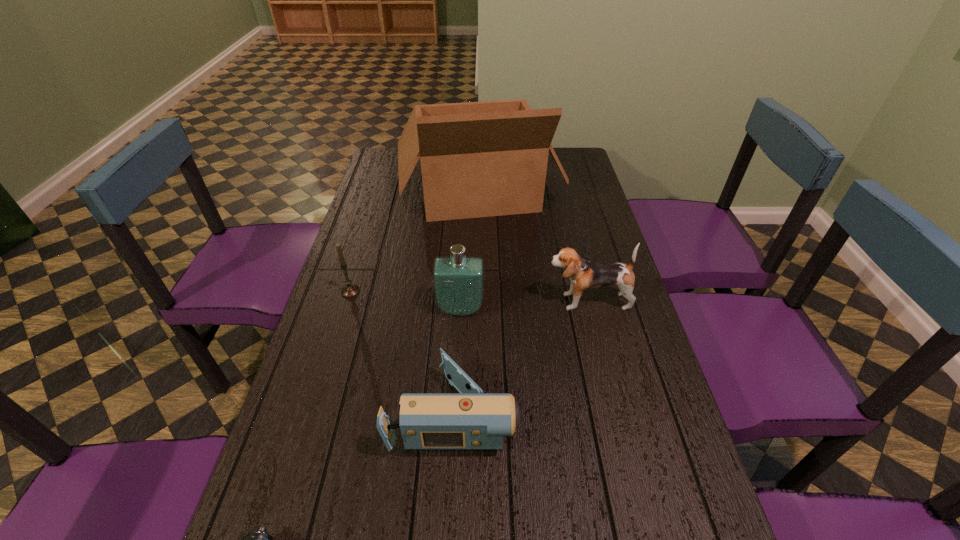
I want to click on free location at the far edge, so click(420, 171).

Find the location of a particular element. This screenshot has width=960, height=540. vacant area at the right edge of the desktop is located at coordinates (685, 457).

Locate an element on the screen. vacant region at the far left corner of the desktop is located at coordinates (384, 172).

Locate an element on the screen. vacant area that lies between the farthest object and the puppy is located at coordinates (533, 246).

Locate an element on the screen. The height and width of the screenshot is (540, 960). free area in between the tallest object and the candle is located at coordinates [x=415, y=241].

At what (x,y) coordinates should I click in order to perform the action: click on free space between the perfume and the puppy. Please return your answer as a coordinate pair (x, y). The height and width of the screenshot is (540, 960). Looking at the image, I should click on (524, 305).

Where is `free spot between the farthest object and the perfume`? free spot between the farthest object and the perfume is located at coordinates (469, 250).

Where is `free space between the tallest object and the candle`? free space between the tallest object and the candle is located at coordinates [415, 241].

Where is `vacant area that lies between the farthest object and the perfume`? The height and width of the screenshot is (540, 960). vacant area that lies between the farthest object and the perfume is located at coordinates (469, 250).

Locate which object ranks fourth in proximity to the shortest object. Please provide its 2D coordinates. Your answer should be formatted as a tuple, i.e. [(x, y)], where the tuple contains the x and y coordinates of a point satisfying the conditions above.

[(584, 275)]